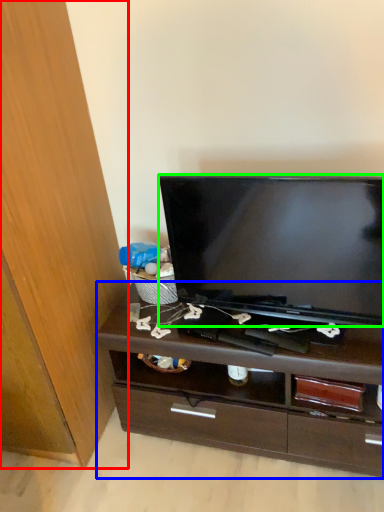
Question: Which object is positioned farthest from cabinetry (highlighted by a red box)? Select from chest of drawers (highlighted by a blue box) and television (highlighted by a green box).

Choices:
 (A) chest of drawers
 (B) television

Answer: (B)